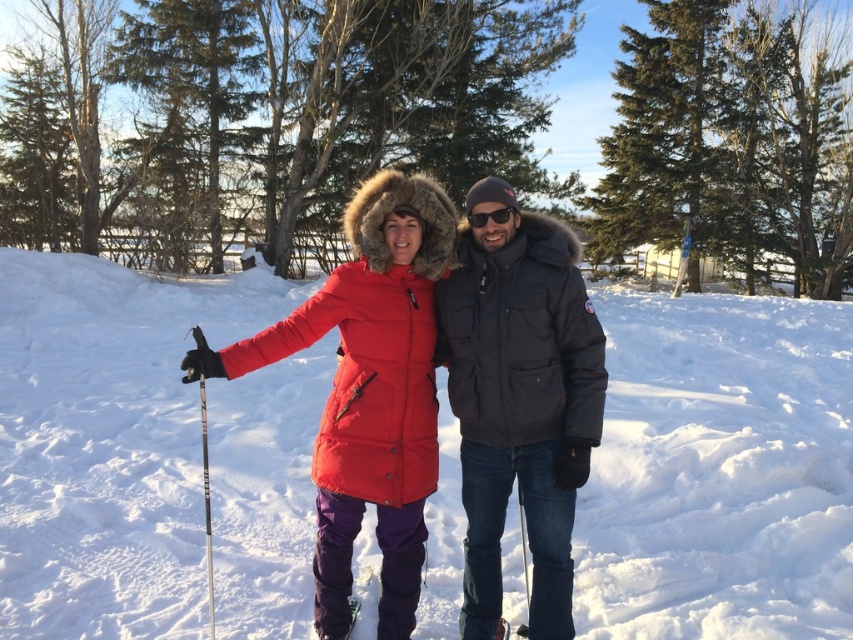
You are planning to build a snowman using the white fluffy snow at center and the matte black jacket at center. Which object can be used as the base of the snowman?

The white fluffy snow at center is taller than the matte black jacket at center, so it can be used as the base of the snowman since it is taller and provides a stable foundation.

You are taking a photo of two people in a snowy landscape. The first person is at point (468, 422) and the second person is at point (474, 227). Which person is closer to the camera?

Point (468, 422) is further to the camera than point (474, 227). Therefore, the second person at point (474, 227) is closer to the camera.

You are standing at the point marked as point (519,401) in the image. What object is located exactly at this point?

The matte black jacket at center is located exactly at point (519,401).